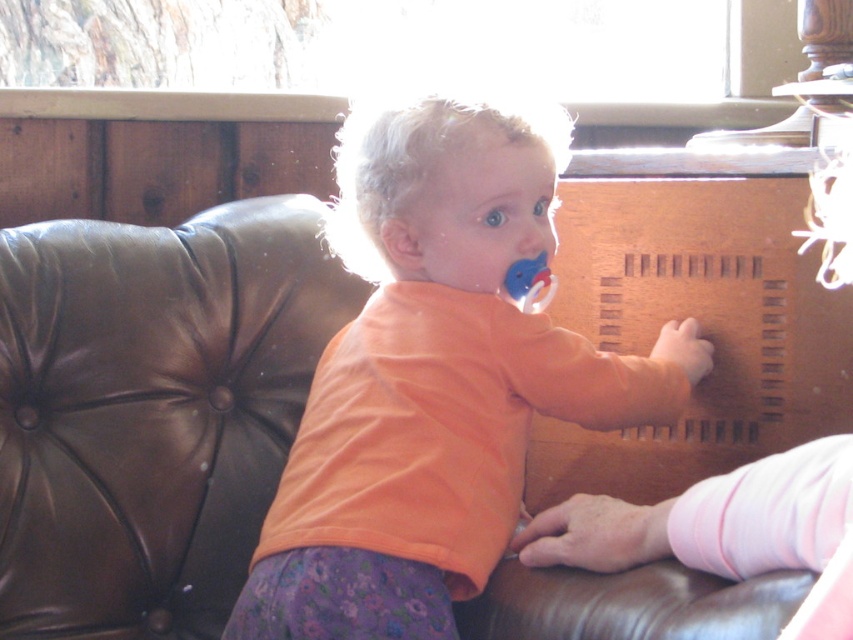
You are a photographer setting up for a family photo. You notice the orange cotton shirt at center and the blue rubber pacifier at upper center in the scene. Which object is positioned higher in the image?

The blue rubber pacifier at upper center is positioned higher than the orange cotton shirt at center.

You are a photographer setting up for a family portrait. The orange cotton shirt at center and the blue rubber pacifier at upper center are in the frame. Based on their distance, which object is closer to the camera?

The orange cotton shirt at center is 7.75 inches away from the blue rubber pacifier at upper center. Since the question asks which is closer to the camera, the answer depends on the direction of measurement. However, without additional information about their positions relative to the camera, we cannot definitively determine which is closer. The given distance alone between the two objects does not provide enough data to establish their individual distances from the camera.